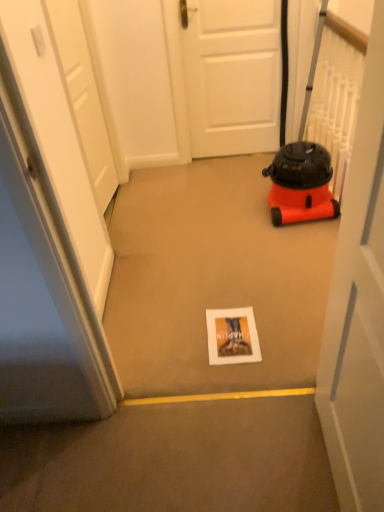
What are the coordinates of `blank space above matte paper postcard at center (from a real-world perspective)` in the screenshot? It's located at (221, 329).